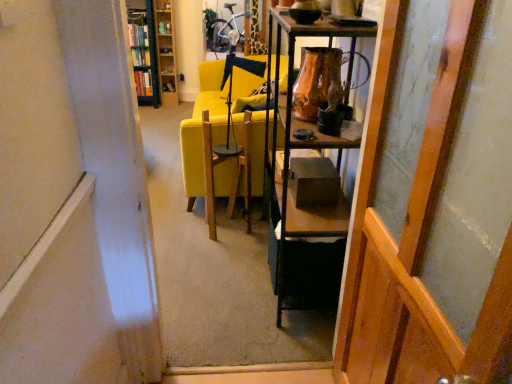
Identify the location of brown glazed vase at upper center. Image resolution: width=512 pixels, height=384 pixels. (317, 82).

Describe the element at coordinates (305, 15) in the screenshot. This screenshot has width=512, height=384. I see `matte black bowl at upper center` at that location.

You are a GUI agent. You are given a task and a screenshot of the screen. Output one action in this format:
    pyautogui.click(x=<x>, y=<y>)
    Task: Click on the yellow fabric couch at center
    
    Given the screenshot: What is the action you would take?
    pyautogui.click(x=201, y=140)

Is point (297, 18) farther from viewer compared to point (261, 161)?

No.

Could you tell me if matte black bowl at upper center is facing wooden chair at center?

No.

Do you think matte black bowl at upper center is within wooden chair at center, or outside of it?

matte black bowl at upper center lies outside wooden chair at center.

Is wooden bookshelf at upper left, the 2th cabinetry in the left-to-right sequence, facing away from brown glazed vase at upper center?

wooden bookshelf at upper left, the 2th cabinetry in the left-to-right sequence, does not have its back to brown glazed vase at upper center.

Is wooden bookshelf at upper left, which ranks as the 1th cabinetry in right-to-left order, wider than brown glazed vase at upper center?

Correct, the width of wooden bookshelf at upper left, which ranks as the 1th cabinetry in right-to-left order, exceeds that of brown glazed vase at upper center.

The width and height of the screenshot is (512, 384). What are the coordinates of `cabinetry that is the 2nd one when counting upward from the brown glazed vase at upper center (from the image's perspective)` in the screenshot? It's located at (166, 51).

Is wooden bookshelf at upper left, the 2th cabinetry in the left-to-right sequence, taller or shorter than brown glazed vase at upper center?

wooden bookshelf at upper left, the 2th cabinetry in the left-to-right sequence, is taller than brown glazed vase at upper center.

From the image's perspective, between green metal bookshelf at upper left, which is the 2th cabinetry in right-to-left order, and matte black bowl at upper center, which one is located above?

From the image's view, green metal bookshelf at upper left, which is the 2th cabinetry in right-to-left order, is above.

Is green metal bookshelf at upper left, which is the 2th cabinetry in right-to-left order, beside matte black bowl at upper center?

There is a gap between green metal bookshelf at upper left, which is the 2th cabinetry in right-to-left order, and matte black bowl at upper center.

Consider the image. Relative to matte black bowl at upper center, is green metal bookshelf at upper left, marked as the first cabinetry in a left-to-right arrangement, in front or behind?

Visually, green metal bookshelf at upper left, marked as the first cabinetry in a left-to-right arrangement, is located behind matte black bowl at upper center.

Looking at this image, between green metal bookshelf at upper left, marked as the first cabinetry in a left-to-right arrangement, and matte black bowl at upper center, which one appears on the right side from the viewer's perspective?

From the viewer's perspective, matte black bowl at upper center appears more on the right side.

In the scene shown: How many degrees apart are the facing directions of wooden bookshelf at upper left, which ranks as the 1th cabinetry in right-to-left order, and wooden chair at center?

The angle between the facing direction of wooden bookshelf at upper left, which ranks as the 1th cabinetry in right-to-left order, and the facing direction of wooden chair at center is 80.1 degrees.

Does wooden bookshelf at upper left, the 2th cabinetry in the left-to-right sequence, come behind wooden chair at center?

Yes, wooden bookshelf at upper left, the 2th cabinetry in the left-to-right sequence, is behind wooden chair at center.

From a real-world perspective, which is physically below, wooden bookshelf at upper left, the 2th cabinetry in the left-to-right sequence, or wooden chair at center?

wooden chair at center is physically lower.

From the image's perspective, is wooden bookshelf at upper left, which ranks as the 1th cabinetry in right-to-left order, under wooden chair at center?

No, from the image's perspective, wooden bookshelf at upper left, which ranks as the 1th cabinetry in right-to-left order, is not beneath wooden chair at center.

Consider the image. Is yellow fabric couch at center in front of or behind wooden chair at center in the image?

Clearly, yellow fabric couch at center is behind wooden chair at center.

Is wooden chair at center completely or partially inside yellow fabric couch at center?

No, yellow fabric couch at center does not contain wooden chair at center.

At what (x,y) coordinates should I click in order to perform the action: click on studio couch lying behind the wooden chair at center. Please return your answer as a coordinate pair (x, y). Looking at the image, I should click on (201, 140).

Is wooden chair at center located outside matte black bowl at upper center?

Indeed, wooden chair at center is completely outside matte black bowl at upper center.

The width and height of the screenshot is (512, 384). I want to click on chair below the matte black bowl at upper center (from a real-world perspective), so click(x=222, y=164).

Is wooden chair at center to the left or to the right of matte black bowl at upper center in the image?

Clearly, wooden chair at center is on the left of matte black bowl at upper center in the image.

From the image's perspective, between wooden chair at center and matte black bowl at upper center, which one is located above?

matte black bowl at upper center is shown above in the image.

Is matte black bowl at upper center located outside green metal bookshelf at upper left, marked as the first cabinetry in a left-to-right arrangement?

Absolutely, matte black bowl at upper center is external to green metal bookshelf at upper left, marked as the first cabinetry in a left-to-right arrangement.

Which is closer, (x=298, y=11) or (x=147, y=3)?

The point (x=298, y=11) is more forward.

In the image, is matte black bowl at upper center on the left side or the right side of green metal bookshelf at upper left, which is the 2th cabinetry in right-to-left order?

matte black bowl at upper center is positioned on green metal bookshelf at upper left, which is the 2th cabinetry in right-to-left order,'s right side.

Between matte black bowl at upper center and green metal bookshelf at upper left, which is the 2th cabinetry in right-to-left order, which one has less height?

matte black bowl at upper center.

This screenshot has width=512, height=384. I want to click on bowl that is above the wooden chair at center (from a real-world perspective), so click(305, 15).

Where is `vase that appears below the wooden bookshelf at upper left, the 2th cabinetry in the left-to-right sequence (from the image's perspective)`? vase that appears below the wooden bookshelf at upper left, the 2th cabinetry in the left-to-right sequence (from the image's perspective) is located at coordinates (317, 82).

Based on the photo, looking at the image, which one is located further to yellow fabric couch at center, wooden chair at center or black matte box at center?

black matte box at center.

Looking at the image, which one is located further to wooden chair at center, wooden bookshelf at upper left, which ranks as the 1th cabinetry in right-to-left order, or black matte box at center?

wooden bookshelf at upper left, which ranks as the 1th cabinetry in right-to-left order, is positioned further to the anchor wooden chair at center.

Based on their spatial positions, is wooden bookshelf at upper left, which ranks as the 1th cabinetry in right-to-left order, or black matte box at center further from matte black bowl at upper center?

Among the two, wooden bookshelf at upper left, which ranks as the 1th cabinetry in right-to-left order, is located further to matte black bowl at upper center.

When comparing their distances from wooden chair at center, does green metal bookshelf at upper left, which is the 2th cabinetry in right-to-left order, or wooden bookshelf at upper left, which ranks as the 1th cabinetry in right-to-left order, seem closer?

Among the two, green metal bookshelf at upper left, which is the 2th cabinetry in right-to-left order, is located nearer to wooden chair at center.

When comparing their distances from brown glazed vase at upper center, does wooden bookshelf at upper left, which ranks as the 1th cabinetry in right-to-left order, or wooden chair at center seem closer?

Based on the image, wooden chair at center appears to be nearer to brown glazed vase at upper center.

Considering their positions, is black matte box at center positioned further to wooden chair at center than yellow fabric couch at center?

black matte box at center lies further to wooden chair at center than the other object.

Estimate the real-world distances between objects in this image. Which object is further from brown glazed vase at upper center, yellow fabric couch at center or black matte box at center?

yellow fabric couch at center is positioned further to the anchor brown glazed vase at upper center.

When comparing their distances from wooden bookshelf at upper left, which ranks as the 1th cabinetry in right-to-left order, does wooden chair at center or brown glazed vase at upper center seem closer?

Based on the image, wooden chair at center appears to be nearer to wooden bookshelf at upper left, which ranks as the 1th cabinetry in right-to-left order.

Where is `chair located between black matte box at center and yellow fabric couch at center in the depth direction`? This screenshot has width=512, height=384. chair located between black matte box at center and yellow fabric couch at center in the depth direction is located at coordinates (222, 164).

The width and height of the screenshot is (512, 384). I want to click on studio couch between matte black bowl at upper center and green metal bookshelf at upper left, marked as the first cabinetry in a left-to-right arrangement, along the z-axis, so click(201, 140).

The width and height of the screenshot is (512, 384). I want to click on studio couch between wooden chair at center and green metal bookshelf at upper left, which is the 2th cabinetry in right-to-left order, from front to back, so click(x=201, y=140).

Locate an element on the screen. box positioned between brown glazed vase at upper center and wooden bookshelf at upper left, which ranks as the 1th cabinetry in right-to-left order, from near to far is located at coordinates (313, 180).